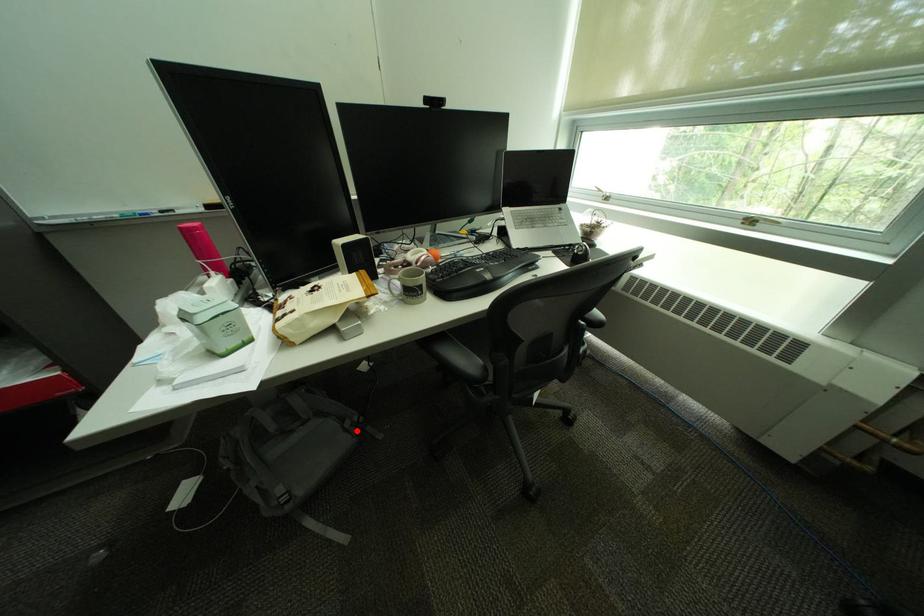
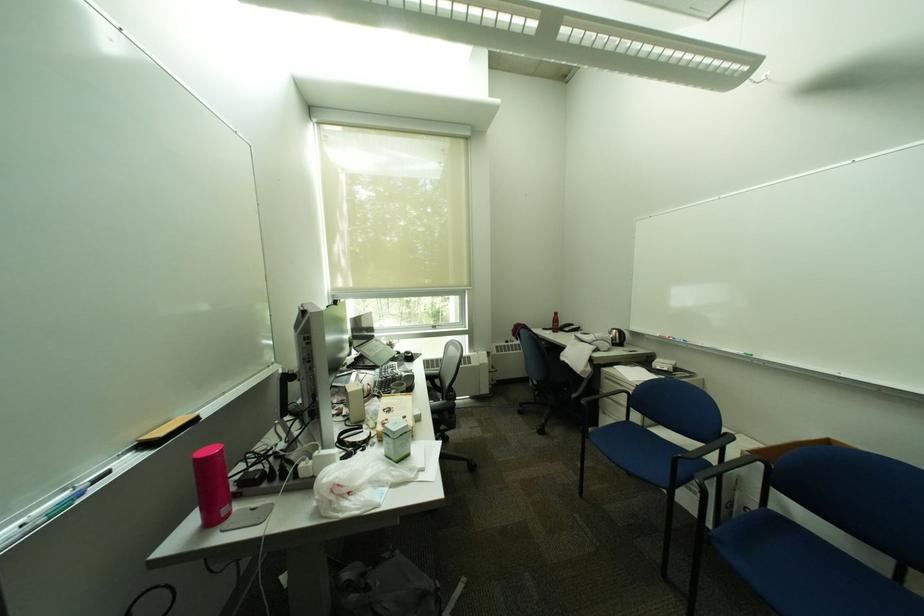
Question: I am providing you with two images of the same scene from different viewpoints. A red point is shown in image1. For the corresponding object point in image2, is it positioned nearer or farther from the camera?

Choices:
 (A) Nearer
 (B) Farther

Answer: (A)